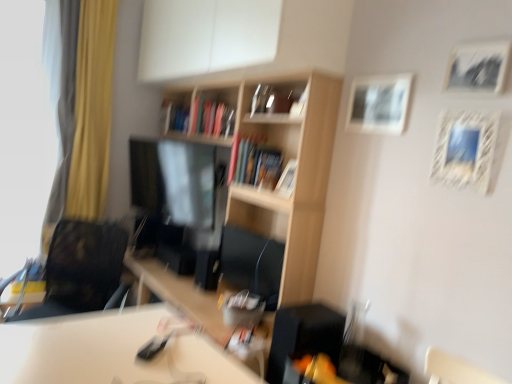
Where is `white matte picture frame at upper right, which is the 2th picture frame from left to right`? This screenshot has width=512, height=384. white matte picture frame at upper right, which is the 2th picture frame from left to right is located at coordinates (379, 104).

Image resolution: width=512 pixels, height=384 pixels. What do you see at coordinates (379, 104) in the screenshot? I see `white matte picture frame at upper right, which is the 2th picture frame from left to right` at bounding box center [379, 104].

What do you see at coordinates (174, 117) in the screenshot?
I see `hardcover book at center, the 2th book ordered from the bottom` at bounding box center [174, 117].

I want to click on wooden bookshelf at center, so click(280, 169).

Measure the distance between wooden bookshelf at center and camera.

They are 6.52 feet apart.

Measure the distance between point (36,195) and camera.

Point (36,195) and camera are 3.00 meters apart.

What are the coordinates of `black matte picture frame at upper right, which ranks as the 1th picture frame in front-to-back order` in the screenshot? It's located at (477, 68).

Where is `white matte picture frame at upper right, the 3th picture frame from the front`? Image resolution: width=512 pixels, height=384 pixels. white matte picture frame at upper right, the 3th picture frame from the front is located at coordinates (379, 104).

Which object is wider, white textured picture frame at upper right, marked as the 3th picture frame in a left-to-right arrangement, or transparent glass window screen at left?

transparent glass window screen at left is wider.

Between white textured picture frame at upper right, positioned as the second picture frame in front-to-back order, and transparent glass window screen at left, which one has less height?

white textured picture frame at upper right, positioned as the second picture frame in front-to-back order, is shorter.

Considering the points (466, 139) and (24, 78), which point is in front, point (466, 139) or point (24, 78)?

The point (466, 139) is more forward.

Is transparent glass window screen at left at the back of white textured picture frame at upper right, marked as the 3th picture frame in a left-to-right arrangement?

No.

From a real-world perspective, which object rests below the other?

From a 3D spatial view, hardcover book at center, the second book when ordered from back to front, is below.

Is white textured picture frame at upper right, arranged as the 2th picture frame when viewed from the right, with hardcover book at center, the first book positioned from the right?

No, white textured picture frame at upper right, arranged as the 2th picture frame when viewed from the right, is not next to hardcover book at center, the first book positioned from the right.

Identify the location of the 3rd picture frame in front of the hardcover book at center, which is the 2th book in top-to-bottom order. This screenshot has width=512, height=384. [x=465, y=149].

Is white textured picture frame at upper right, positioned as the second picture frame in front-to-back order, wider or thinner than hardcover book at center, which is the 2th book in top-to-bottom order?

In the image, white textured picture frame at upper right, positioned as the second picture frame in front-to-back order, appears to be more narrow than hardcover book at center, which is the 2th book in top-to-bottom order.

In terms of height, does white textured picture frame at upper right, arranged as the 2th picture frame when viewed from the right, look taller or shorter compared to white matte picture frame at upper right, the 2th picture frame viewed from the back?

white textured picture frame at upper right, arranged as the 2th picture frame when viewed from the right, is taller than white matte picture frame at upper right, the 2th picture frame viewed from the back.

Considering their positions, is white textured picture frame at upper right, marked as the 3th picture frame in a left-to-right arrangement, located in front of or behind white matte picture frame at upper right, the 2th picture frame viewed from the back?

white textured picture frame at upper right, marked as the 3th picture frame in a left-to-right arrangement, is in front of white matte picture frame at upper right, the 2th picture frame viewed from the back.

Which is more to the right, white textured picture frame at upper right, the 3th picture frame from the back, or white matte picture frame at upper right, placed as the 3th picture frame when sorted from right to left?

Positioned to the right is white textured picture frame at upper right, the 3th picture frame from the back.

Would you say white textured picture frame at upper right, marked as the 3th picture frame in a left-to-right arrangement, is inside or outside white matte picture frame at upper right, the 2th picture frame viewed from the back?

white textured picture frame at upper right, marked as the 3th picture frame in a left-to-right arrangement, exists outside the volume of white matte picture frame at upper right, the 2th picture frame viewed from the back.

Which point is more forward, (186, 129) or (243, 169)?

The point (243, 169) is in front.

Can you confirm if hardcover book at center, which appears as the first book when viewed from the back, is bigger than hardcover book at center, which is the 2th book in top-to-bottom order?

No.

Considering the relative positions of hardcover book at center, the 1th book when ordered from left to right, and hardcover book at center, the 1th book when ordered from bottom to top, in the image provided, is hardcover book at center, the 1th book when ordered from left to right, to the right of hardcover book at center, the 1th book when ordered from bottom to top, from the viewer's perspective?

In fact, hardcover book at center, the 1th book when ordered from left to right, is to the left of hardcover book at center, the 1th book when ordered from bottom to top.

Is hardcover book at center, arranged as the second book when viewed from the front, located outside hardcover book at center, arranged as the 1th book when viewed from the front?

Yes.

Consider the image. Is white matte picture frame at upper right, the 2th picture frame viewed from the back, oriented away from white glossy table at lower center?

No, white glossy table at lower center is not at the back of white matte picture frame at upper right, the 2th picture frame viewed from the back.

What's the angular difference between white matte picture frame at upper right, placed as the 3th picture frame when sorted from right to left, and white glossy table at lower center's facing directions?

white matte picture frame at upper right, placed as the 3th picture frame when sorted from right to left, and white glossy table at lower center are facing 4.66 degrees away from each other.

Considering the sizes of objects white matte picture frame at upper right, placed as the 3th picture frame when sorted from right to left, and white glossy table at lower center in the image provided, who is shorter, white matte picture frame at upper right, placed as the 3th picture frame when sorted from right to left, or white glossy table at lower center?

white matte picture frame at upper right, placed as the 3th picture frame when sorted from right to left, is shorter.

From a real-world perspective, relative to white glossy table at lower center, is white matte picture frame at upper right, placed as the 3th picture frame when sorted from right to left, vertically above or below?

white matte picture frame at upper right, placed as the 3th picture frame when sorted from right to left, is situated higher than white glossy table at lower center in the real world.

From the image's perspective, which is below, wooden picture frame at center, placed as the 4th picture frame when sorted from right to left, or transparent glass window screen at left?

wooden picture frame at center, placed as the 4th picture frame when sorted from right to left, is shown below in the image.

Is wooden picture frame at center, which ranks as the first picture frame in left-to-right order, completely or partially outside of transparent glass window screen at left?

Yes, wooden picture frame at center, which ranks as the first picture frame in left-to-right order, is outside of transparent glass window screen at left.

Which of these two, wooden picture frame at center, the 4th picture frame when ordered from front to back, or transparent glass window screen at left, is thinner?

Thinner between the two is wooden picture frame at center, the 4th picture frame when ordered from front to back.

Could you tell me if wooden picture frame at center, which is counted as the 1th picture frame, starting from the back, is turned towards transparent glass window screen at left?

No, wooden picture frame at center, which is counted as the 1th picture frame, starting from the back, is not oriented towards transparent glass window screen at left.

Is wooden bookshelf at center turned away from yellow fabric curtain at left?

That's not correct — wooden bookshelf at center is not looking away from yellow fabric curtain at left.

From a real-world perspective, which is physically below, wooden bookshelf at center or yellow fabric curtain at left?

wooden bookshelf at center, from a real-world perspective.

Is wooden bookshelf at center in front of or behind yellow fabric curtain at left in the image?

wooden bookshelf at center is in front of yellow fabric curtain at left.

Looking at this image, is there a large distance between wooden bookshelf at center and yellow fabric curtain at left?

Absolutely, wooden bookshelf at center is distant from yellow fabric curtain at left.

Where is `window screen on the left of white textured picture frame at upper right, marked as the 3th picture frame in a left-to-right arrangement`? Image resolution: width=512 pixels, height=384 pixels. window screen on the left of white textured picture frame at upper right, marked as the 3th picture frame in a left-to-right arrangement is located at coordinates (27, 124).

Starting from the hardcover book at center, the second book when ordered from back to front, which picture frame is the 3rd one to the right? Please provide its 2D coordinates.

[(465, 149)]

Looking at the image, which one is located further to white matte picture frame at upper right, the 2th picture frame viewed from the back, white matte cabinet at upper center or transparent glass window screen at left?

The object further to white matte picture frame at upper right, the 2th picture frame viewed from the back, is transparent glass window screen at left.

Based on their spatial positions, is white textured picture frame at upper right, arranged as the 2th picture frame when viewed from the right, or wooden bookshelf at center further from white matte cabinet at upper center?

white textured picture frame at upper right, arranged as the 2th picture frame when viewed from the right.

Looking at the image, which one is located closer to wooden picture frame at center, which is counted as the 1th picture frame, starting from the back, transparent glass window screen at left or white textured picture frame at upper right, the 3th picture frame from the back?

Based on the image, white textured picture frame at upper right, the 3th picture frame from the back, appears to be nearer to wooden picture frame at center, which is counted as the 1th picture frame, starting from the back.

Estimate the real-world distances between objects in this image. Which object is closer to transparent glass window screen at left, wooden picture frame at center, which is counted as the 1th picture frame, starting from the back, or white textured picture frame at upper right, marked as the 3th picture frame in a left-to-right arrangement?

Among the two, wooden picture frame at center, which is counted as the 1th picture frame, starting from the back, is located nearer to transparent glass window screen at left.

When comparing their distances from white matte cabinet at upper center, does hardcover book at center, the 1th book when ordered from bottom to top, or white matte picture frame at upper right, the 2th picture frame viewed from the back, seem closer?

hardcover book at center, the 1th book when ordered from bottom to top, lies closer to white matte cabinet at upper center than the other object.

Based on their spatial positions, is wooden bookshelf at center or wooden picture frame at center, placed as the 4th picture frame when sorted from right to left, further from black matte picture frame at upper right, the fourth picture frame positioned from the back?

Based on the image, wooden bookshelf at center appears to be further to black matte picture frame at upper right, the fourth picture frame positioned from the back.

Based on their spatial positions, is hardcover book at center, acting as the first book starting from the top, or wooden bookshelf at center further from black matte picture frame at upper right, the fourth picture frame positioned from the back?

The object further to black matte picture frame at upper right, the fourth picture frame positioned from the back, is hardcover book at center, acting as the first book starting from the top.

Looking at the image, which one is located further to yellow fabric curtain at left, transparent glass window screen at left or white textured picture frame at upper right, arranged as the 2th picture frame when viewed from the right?

Based on the image, white textured picture frame at upper right, arranged as the 2th picture frame when viewed from the right, appears to be further to yellow fabric curtain at left.

Identify the location of curtain situated between transparent glass window screen at left and white matte cabinet at upper center from left to right. This screenshot has height=384, width=512. (83, 114).

Find the location of `shelf between white glossy table at lower center and hardcover book at center, the 1th book when ordered from left to right, from front to back`. shelf between white glossy table at lower center and hardcover book at center, the 1th book when ordered from left to right, from front to back is located at coordinates (280, 169).

Find the location of `table situated between transparent glass window screen at left and white textured picture frame at upper right, the 3th picture frame from the back, from left to right`. table situated between transparent glass window screen at left and white textured picture frame at upper right, the 3th picture frame from the back, from left to right is located at coordinates (112, 351).

Find the location of a particular element. This screenshot has height=384, width=512. book situated between white matte cabinet at upper center and white textured picture frame at upper right, arranged as the 2th picture frame when viewed from the right, from left to right is located at coordinates (262, 167).